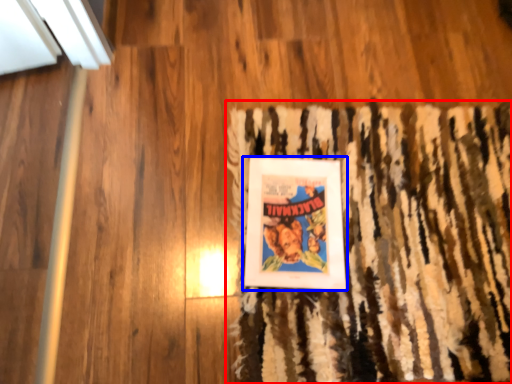
Question: Which object is further to the camera taking this photo, doormat (highlighted by a red box) or picture frame (highlighted by a blue box)?

Choices:
 (A) doormat
 (B) picture frame

Answer: (B)